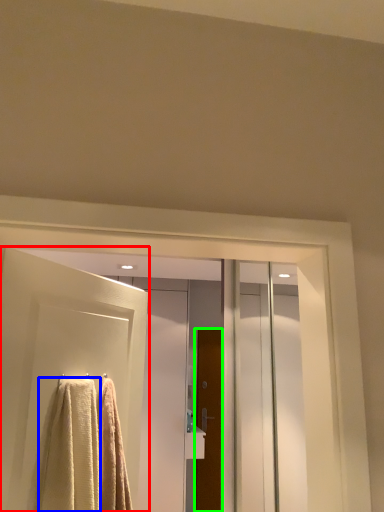
Question: Estimate the real-world distances between objects in this image. Which object is farther from door (highlighted by a red box), towel (highlighted by a blue box) or door (highlighted by a green box)?

Choices:
 (A) towel
 (B) door

Answer: (B)